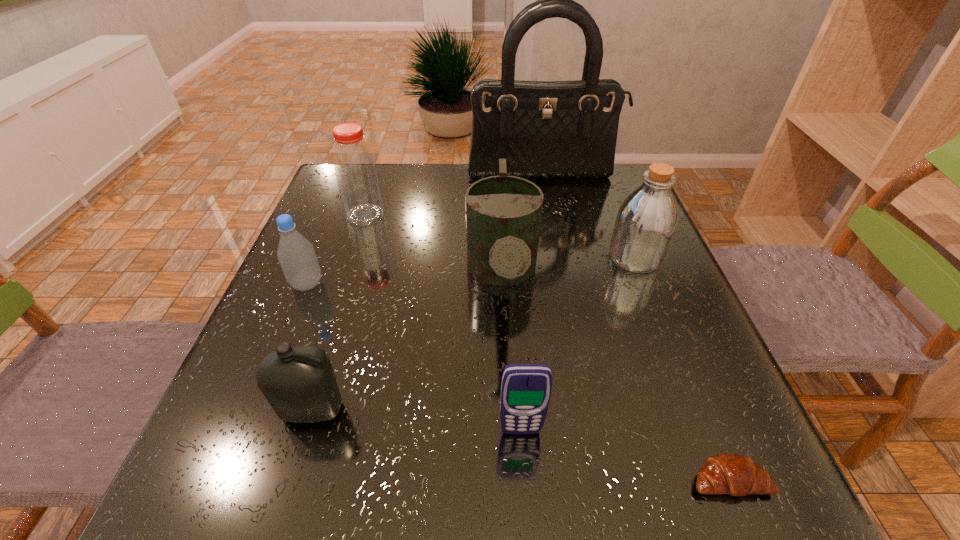
Identify the location of free space at the far right corner of the desktop. (623, 172).

This screenshot has width=960, height=540. I want to click on free space at the near right corner, so click(x=774, y=498).

Locate an element on the screen. free space that is in between the tallest object and the nearest bottle is located at coordinates (427, 293).

Locate an element on the screen. This screenshot has width=960, height=540. vacant area that lies between the watering can and the nearest bottle is located at coordinates (407, 343).

Where is `unoccupied position between the nearest bottle and the crescent roll`? The image size is (960, 540). unoccupied position between the nearest bottle and the crescent roll is located at coordinates (521, 445).

At what (x,y) coordinates should I click in order to perform the action: click on free space between the cellular telephone and the farthest bottle. Please return your answer as a coordinate pair (x, y). Image resolution: width=960 pixels, height=540 pixels. Looking at the image, I should click on (444, 323).

Locate an element on the screen. empty space that is in between the cellular telephone and the watering can is located at coordinates (512, 353).

At what (x,y) coordinates should I click in order to perform the action: click on empty location between the farthest object and the nearest bottle. Please return your answer as a coordinate pair (x, y). This screenshot has height=540, width=960. Looking at the image, I should click on (427, 293).

Find the location of a particular element. The image size is (960, 540). vacant area that lies between the rightmost bottle and the nearest bottle is located at coordinates (474, 334).

Identify which object is located as the fifth nearest to the rightmost bottle. Please provide its 2D coordinates. Your answer should be formatted as a tuple, i.e. [(x, y)], where the tuple contains the x and y coordinates of a point satisfying the conditions above.

[(356, 174)]